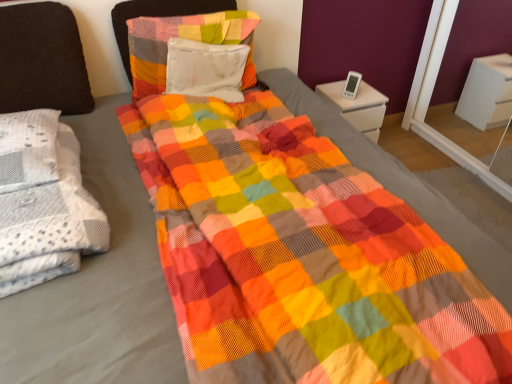
Question: Is textured cotton pillow at upper center, arranged as the second pillow when viewed from the right, bigger or smaller than white glossy nightstand at upper right?

Choices:
 (A) big
 (B) small

Answer: (B)

Question: Considering their positions, is textured cotton pillow at upper center, which is counted as the second pillow, starting from the left, located in front of or behind white glossy nightstand at upper right?

Choices:
 (A) front
 (B) behind

Answer: (A)

Question: Which of these objects is positioned farthest from the white glossy nightstand at upper right?

Choices:
 (A) white fabric pillow at center, which is the first pillow in right-to-left order
 (B) dark brown fabric pillow at left, which ranks as the 3th pillow in right-to-left order
 (C) white textured blanket at left
 (D) textured cotton pillow at upper center, arranged as the second pillow when viewed from the right

Answer: (C)

Question: Estimate the real-world distances between objects in this image. Which object is closer to the textured cotton pillow at upper center, which is counted as the second pillow, starting from the left?

Choices:
 (A) dark brown fabric pillow at left, acting as the first pillow starting from the left
 (B) white fabric pillow at center, which is the first pillow in right-to-left order
 (C) white glossy nightstand at upper right
 (D) white textured blanket at left

Answer: (B)